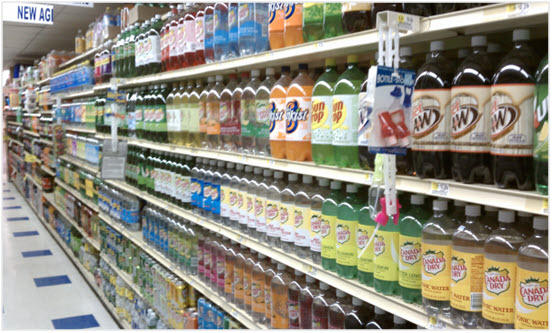
Where is `metal shelves`? metal shelves is located at coordinates (203, 293), (263, 249), (275, 164), (273, 57), (130, 283), (108, 311).